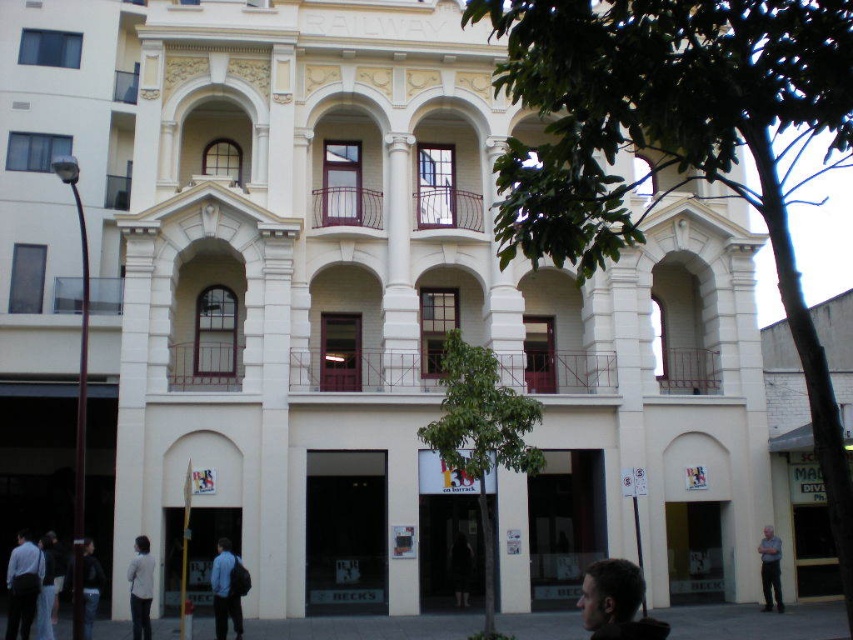
Question: Considering the real-world distances, which object is closest to the dark blue jacket at lower left?

Choices:
 (A) dark fabric jacket at lower center
 (B) light blue shirt at lower left

Answer: (B)

Question: Which point appears closest to the camera in this image?

Choices:
 (A) (776, 588)
 (B) (55, 547)
 (C) (463, 572)
 (D) (85, 554)

Answer: (D)

Question: Can you confirm if dark brown hair at lower right is smaller than gray fabric shirt at lower right?

Choices:
 (A) yes
 (B) no

Answer: (B)

Question: Estimate the real-world distances between objects in this image. Which object is farther from the gray fabric shirt at lower right?

Choices:
 (A) dark fabric jacket at lower center
 (B) dark brown hair at lower right
 (C) white fabric jacket at lower left

Answer: (C)

Question: Observing the image, what is the correct spatial positioning of dark blue shirt at lower left in reference to gray fabric shirt at lower right?

Choices:
 (A) left
 (B) right

Answer: (A)

Question: Can you confirm if dark brown hair at lower right is positioned below blue fabric jacket at lower center?

Choices:
 (A) no
 (B) yes

Answer: (A)